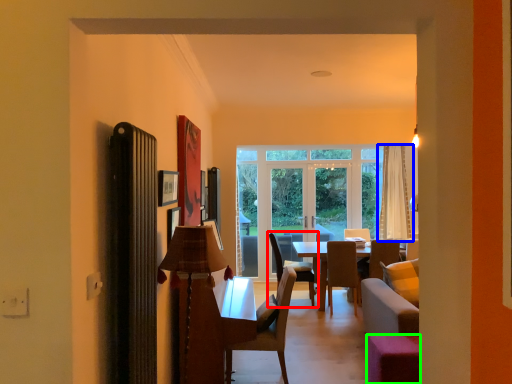
Question: Which object is the closest to the chair (highlighted by a red box)? Choose among these: curtain (highlighted by a blue box) or stool (highlighted by a green box).

Choices:
 (A) curtain
 (B) stool

Answer: (A)